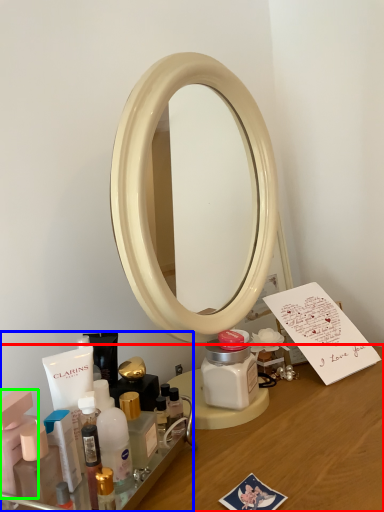
Question: Estimate the real-world distances between objects in this image. Which object is closer to desk (highlighted by a red box), toiletry (highlighted by a blue box) or toiletry (highlighted by a green box)?

Choices:
 (A) toiletry
 (B) toiletry

Answer: (A)